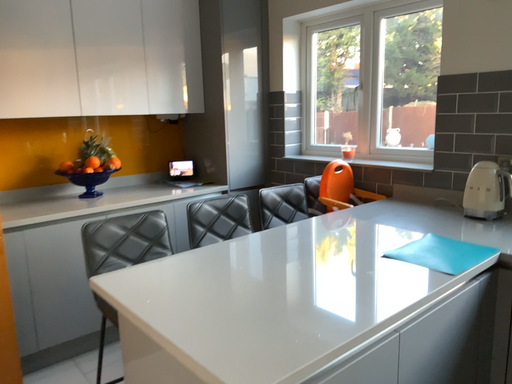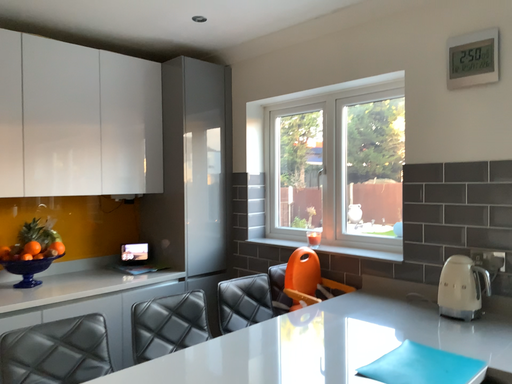
Question: How did the camera likely rotate when shooting the video?

Choices:
 (A) rotated upward
 (B) rotated downward

Answer: (A)